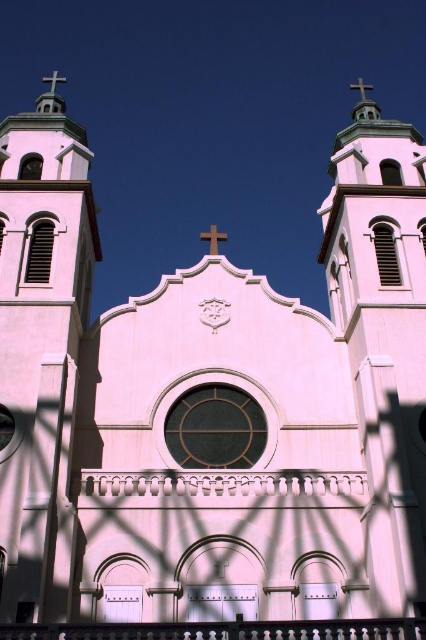
You are standing in front of the church and notice a point marked at coordinates (40, 348). Based on the church facade description, what object is located at this point?

The point at coordinates (40, 348) indicates the white stone cross at left.

From the picture: You are standing in front of the church and looking at its facade. There are two points marked on the image. One is at coordinate point (2, 282) and the other at point (416, 307). Which point is closer to you?

Point (2, 282) is in front of point (416, 307), so the point at (2, 282) is closer to you.